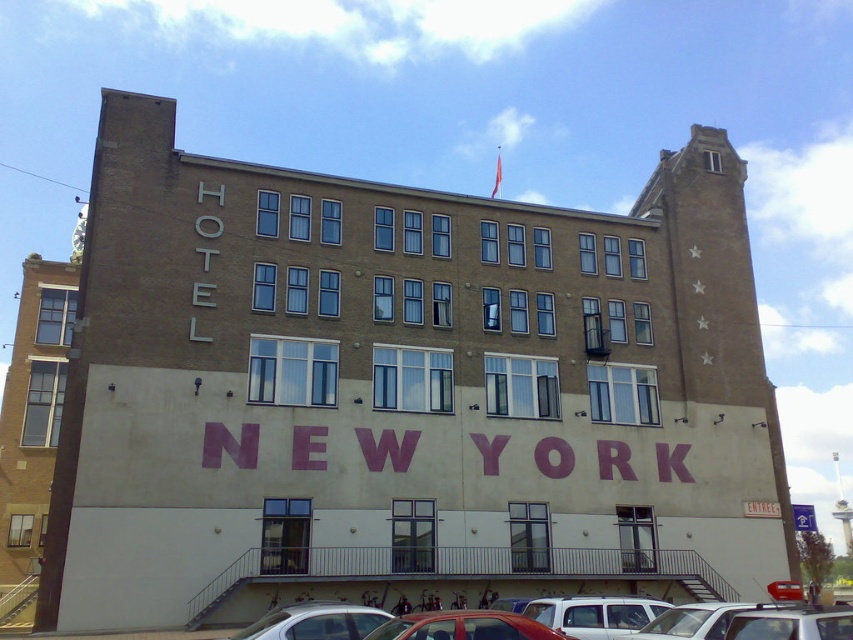
Measure the distance from beige brick building at left to shiny red car at center.

beige brick building at left and shiny red car at center are 108.42 feet apart.

Is beige brick building at left positioned behind shiny red car at center?

Yes.

Is point (30, 424) positioned after point (386, 637)?

Yes.

At what (x,y) coordinates should I click in order to perform the action: click on beige brick building at left. Please return your answer as a coordinate pair (x, y). The height and width of the screenshot is (640, 853). Looking at the image, I should click on (32, 426).

Does shiny red car at center appear on the left side of metallic silver car at center?

Correct, you'll find shiny red car at center to the left of metallic silver car at center.

Between shiny red car at center and metallic silver car at center, which one is positioned lower?

metallic silver car at center is below.

Find the location of a particular element. The image size is (853, 640). shiny red car at center is located at coordinates (463, 627).

Between beige brick building at left and metallic silver car at center, which one is positioned lower?

metallic silver car at center

The image size is (853, 640). Find the location of `beige brick building at left`. beige brick building at left is located at coordinates (32, 426).

Locate an element on the screen. Image resolution: width=853 pixels, height=640 pixels. beige brick building at left is located at coordinates (32, 426).